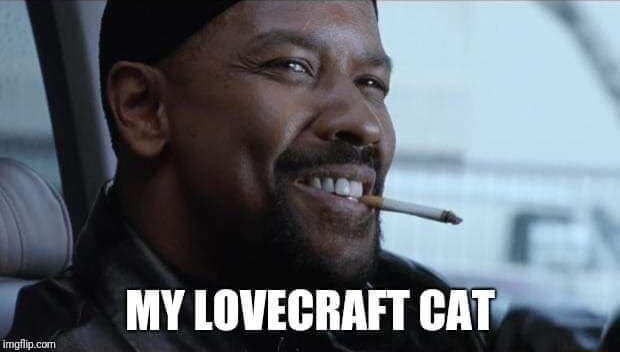
The image size is (620, 352). What are the coordinates of `seat` in the screenshot? It's located at click(29, 228).